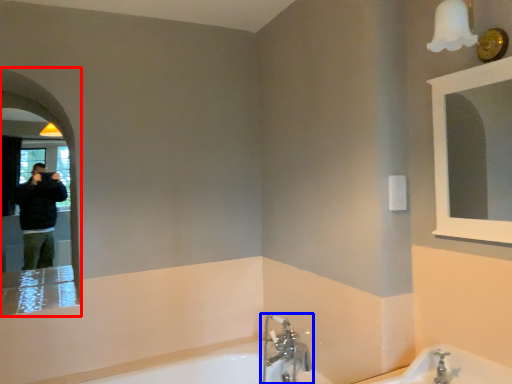
Question: Which of the following is the closest to the observer, mirror (highlighted by a red box) or tap (highlighted by a blue box)?

Choices:
 (A) mirror
 (B) tap

Answer: (A)